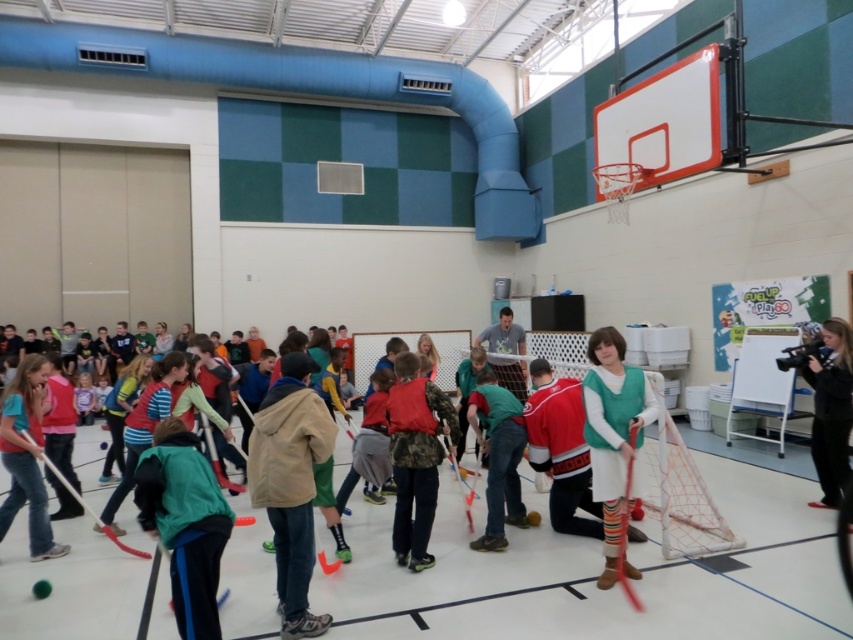
Question: Which of these objects is positioned closest to the green matte vest at center?

Choices:
 (A) green matte jacket at center
 (B) matte plastic hockey stick at lower left
 (C) rubber hockey stick at center
 (D) tan fabric jacket at center

Answer: (D)

Question: In this image, where is tan fabric jacket at center located relative to matte black hockey stick at center?

Choices:
 (A) below
 (B) above

Answer: (B)

Question: Which is farther from the light blue jersey at center?

Choices:
 (A) matte plastic hockey stick at lower left
 (B) green fabric shirt at center
 (C) black fabric camera at right
 (D) rubber hockey stick at center

Answer: (C)

Question: Which of the following is the closest to the observer?

Choices:
 (A) rubber hockey stick at center
 (B) matte plastic hockey stick at lower left
 (C) tan fabric jacket at center
 (D) green fabric shirt at center

Answer: (C)

Question: Does green matte vest at center come in front of rubber hockey stick at center?

Choices:
 (A) no
 (B) yes

Answer: (A)

Question: Can you confirm if matte red hockey stick at center is positioned below matte plastic hockey stick at lower left?

Choices:
 (A) no
 (B) yes

Answer: (A)